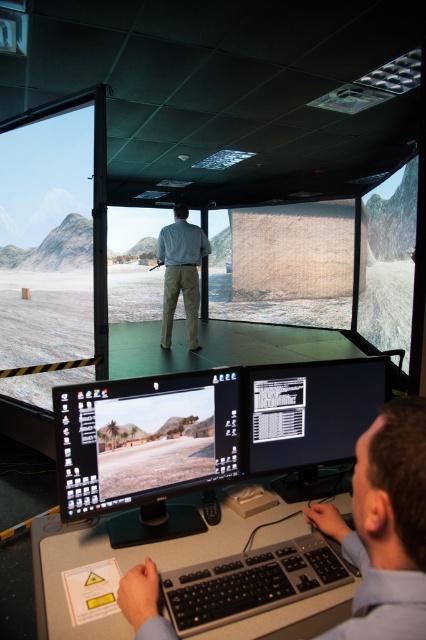
Question: Does matte beige wall at center appear under light brown cotton pants at center?

Choices:
 (A) yes
 (B) no

Answer: (B)

Question: Observing the image, what is the correct spatial positioning of matte beige wall at center in reference to light brown cotton pants at center?

Choices:
 (A) left
 (B) right

Answer: (B)

Question: Which object appears farthest from the camera in this image?

Choices:
 (A) matte glass projection screen at right
 (B) black plastic keyboard at lower center
 (C) black glossy monitor at lower center
 (D) black glossy monitor at center

Answer: (A)

Question: Which of these objects is positioned farthest from the black glossy monitor at center?

Choices:
 (A) matte glass projection screen at right
 (B) matte black monitor at lower center

Answer: (A)

Question: From the image, what is the correct spatial relationship of black plastic keyboard at lower center in relation to matte glass projection screen at right?

Choices:
 (A) above
 (B) below

Answer: (B)

Question: Which of these objects is positioned farthest from the matte black monitor at lower center?

Choices:
 (A) black glossy monitor at center
 (B) matte beige wall at center
 (C) light brown cotton pants at center
 (D) black glossy monitor at lower center

Answer: (B)